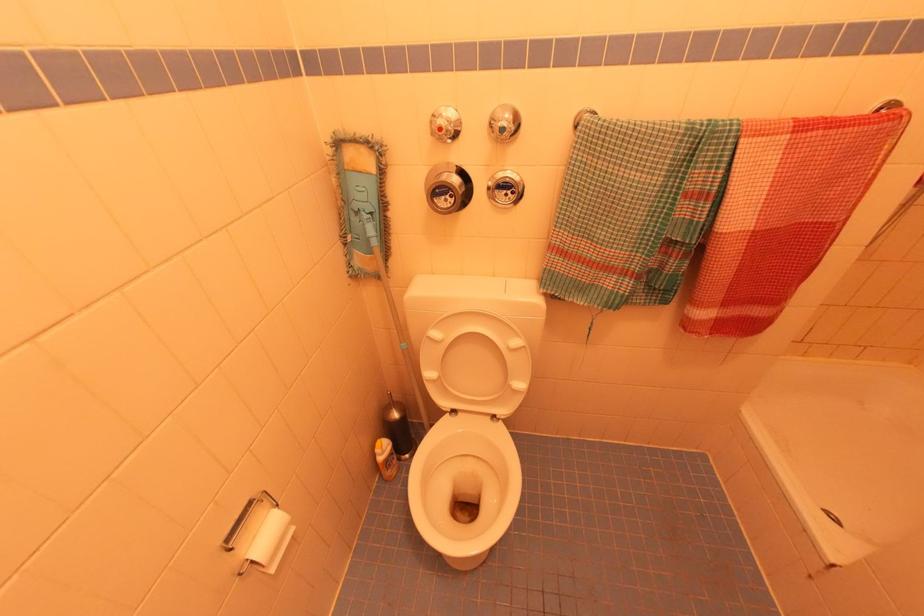
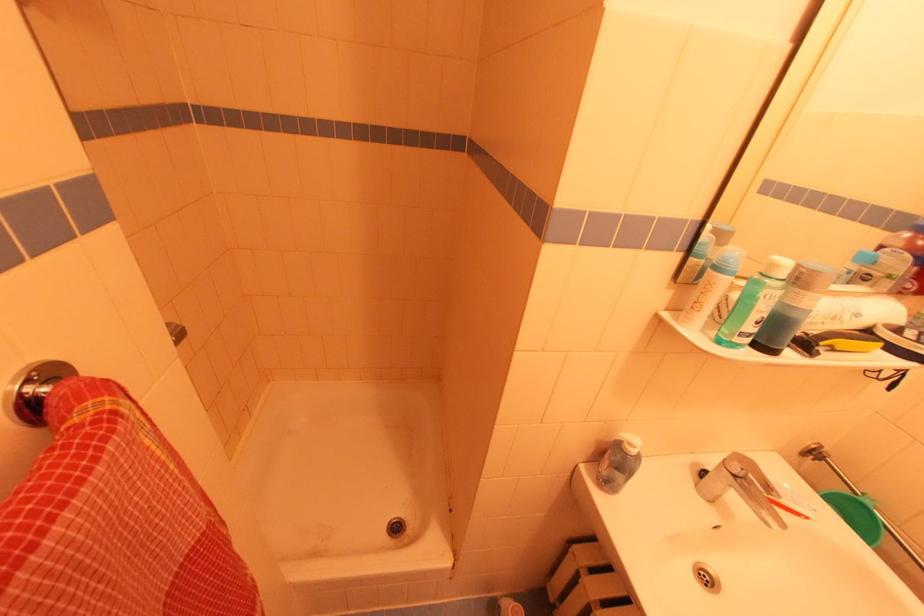
Based on the continuous images, in which direction is the camera rotating?

The camera's rotation is toward right-down.